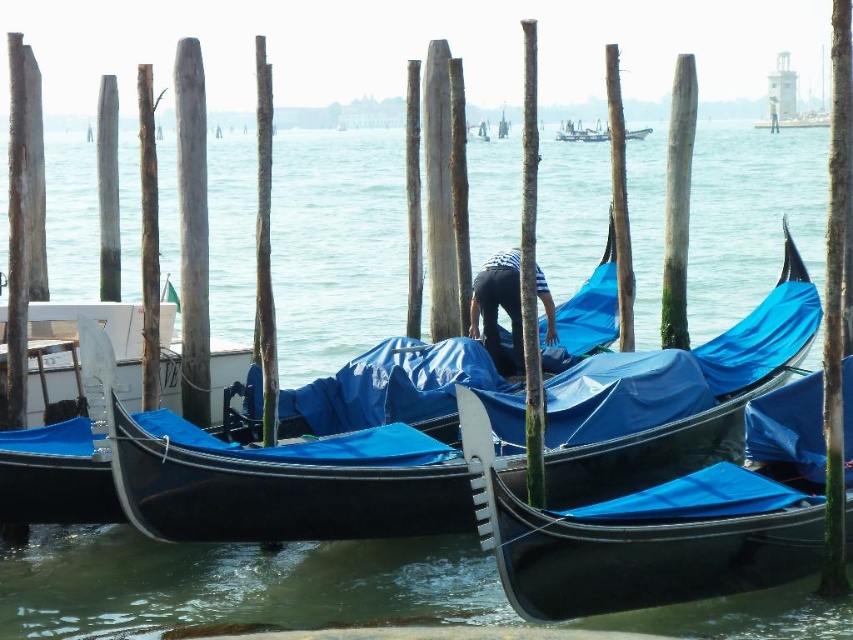
Question: Estimate the real-world distances between objects in this image. Which object is closer to the blue tarpaulin canoe at center?

Choices:
 (A) shiny blue gondola at center
 (B) blue tarpaulin boat at center

Answer: (A)

Question: Can you confirm if shiny blue gondola at center is bigger than blue tarpaulin boat at center?

Choices:
 (A) yes
 (B) no

Answer: (B)

Question: Is blue tarpaulin canoe at center smaller than blue tarpaulin boat at center?

Choices:
 (A) no
 (B) yes

Answer: (B)

Question: Which point is farther to the camera?

Choices:
 (A) (73, 483)
 (B) (573, 140)

Answer: (B)

Question: In this image, where is blue tarpaulin canoe at center located relative to blue tarpaulin boat at center?

Choices:
 (A) right
 (B) left

Answer: (B)

Question: Which object appears farthest from the camera in this image?

Choices:
 (A) shiny blue gondola at center
 (B) blue tarpaulin boat at center

Answer: (B)